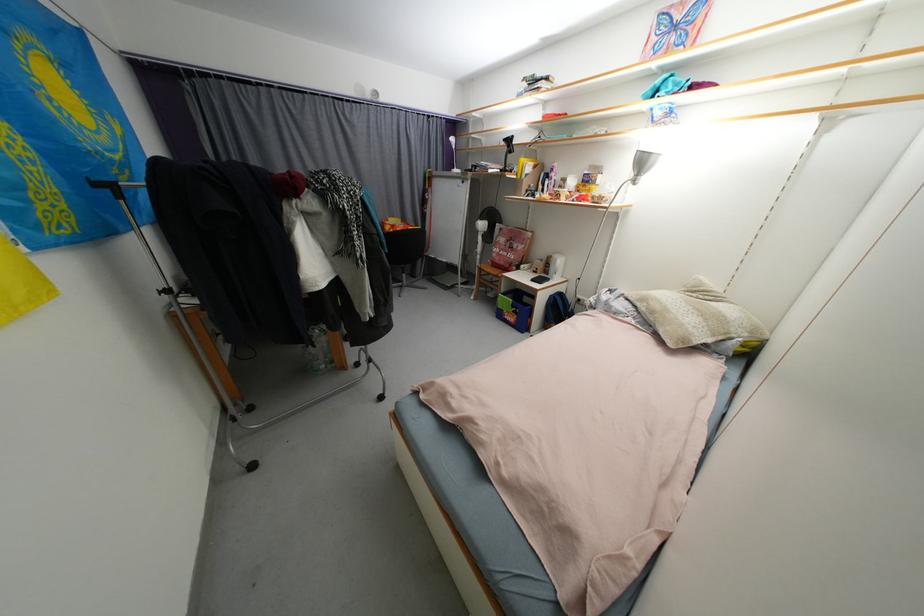
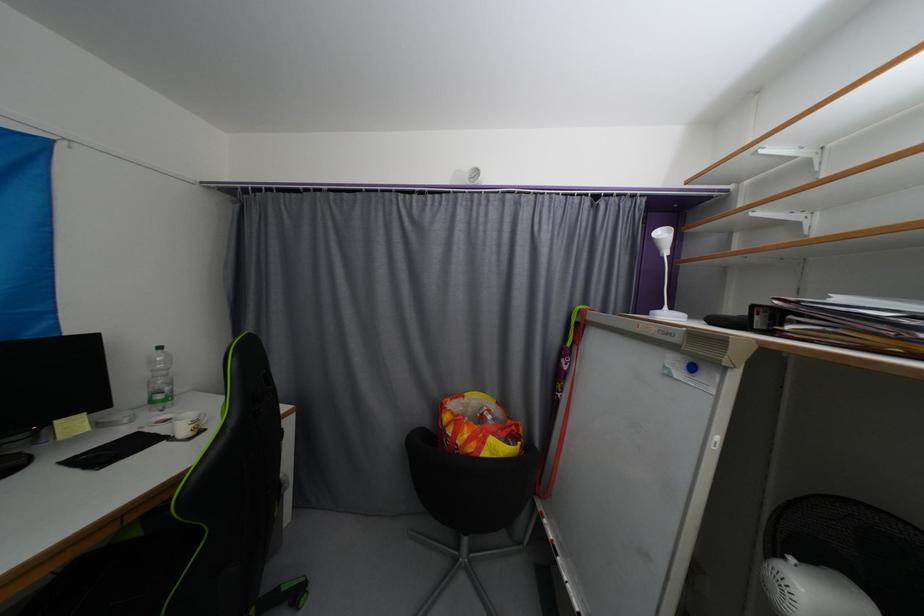
Where in the second image is the point corresponding to pixel 460 172 from the first image?

(672, 317)